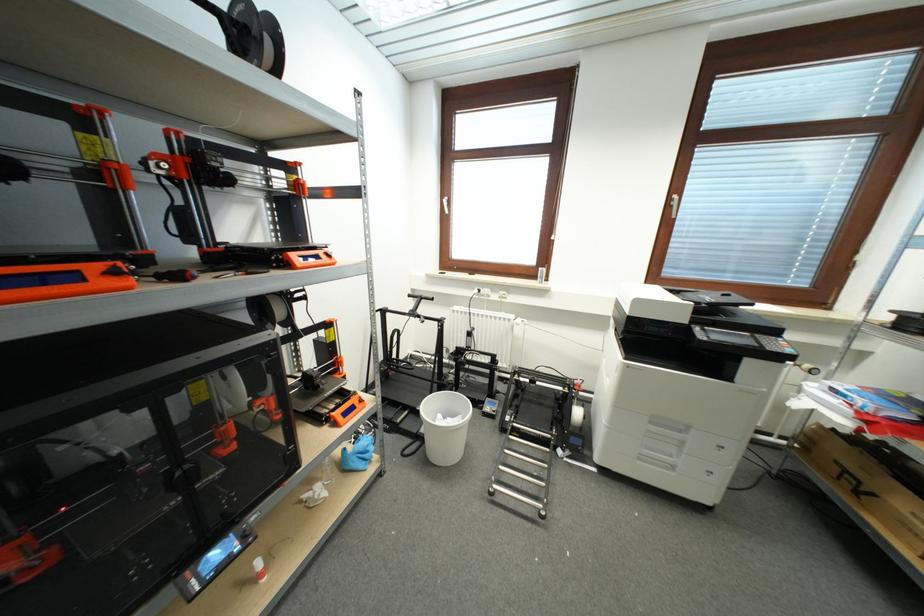
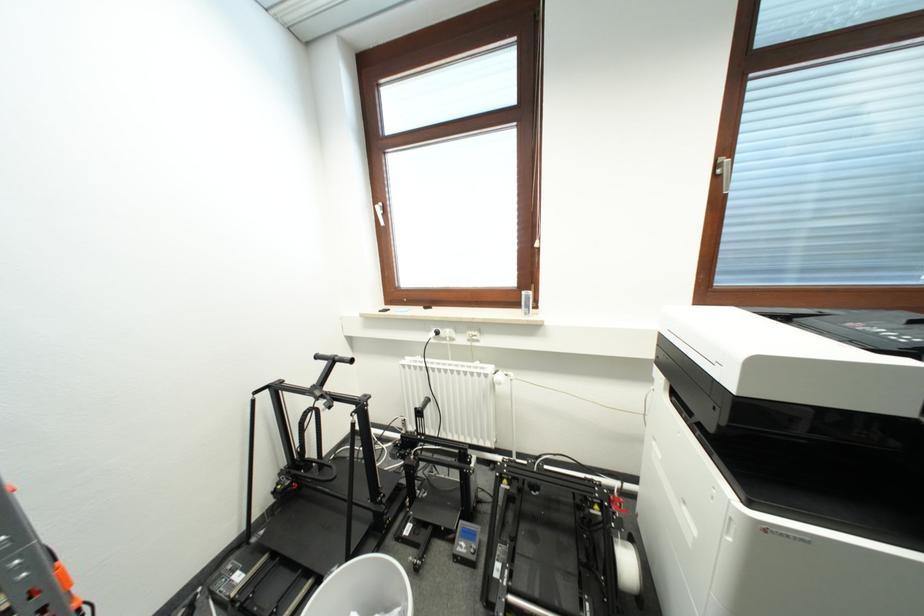
Question: The images are taken continuously from a first-person perspective. In which direction is your viewpoint rotating?

Choices:
 (A) Left
 (B) Right
 (C) Up
 (D) Down

Answer: (C)